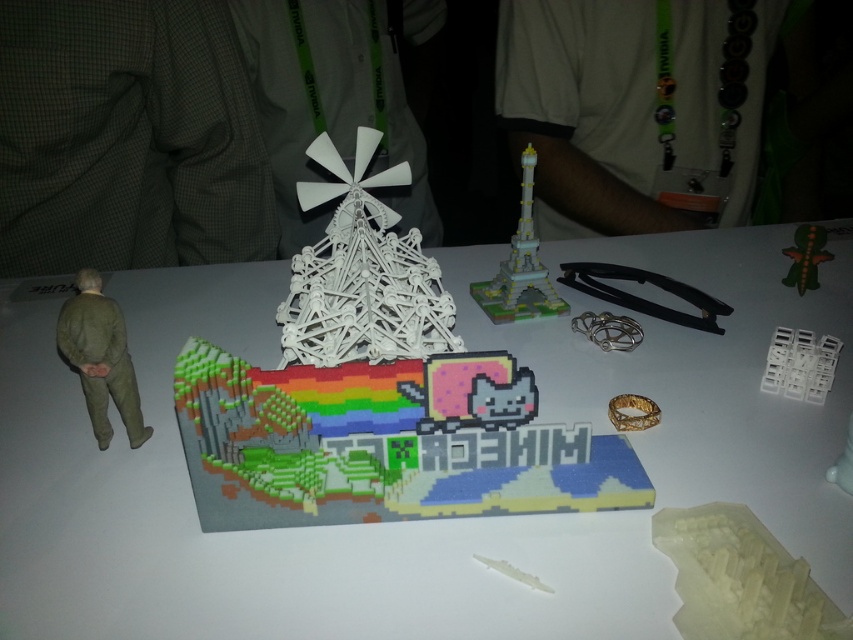
You are a collector who wants to place both the matte plastic pixel art at center and the green matte figure at left on a shelf. The shelf has a height limit of 12 inches. Can you determine if both items will fit vertically on the shelf based on their sizes?

The matte plastic pixel art at center is larger in size than green matte figure at left. However, without specific height measurements, it is impossible to determine if both items will fit within the 12 inch height limit. More information about their individual heights is needed.

You are a collector who wants to display the matte plastic pixel art at center and the green matte figure at left on a shelf. If the shelf has a height limit of 10 cm, which object might not fit if the pixel art is 12 cm tall?

The matte plastic pixel art at center is taller than the green matte figure at left. Since the pixel art is 12 cm tall, exceeding the 10 cm height limit, it might not fit on the shelf.